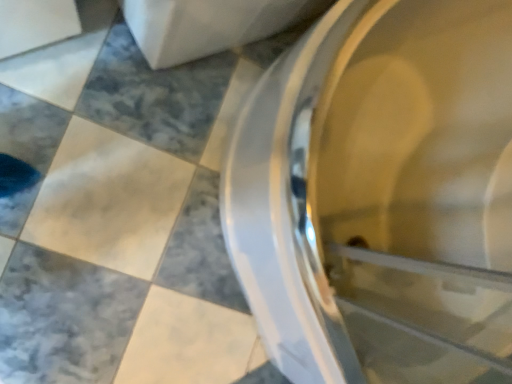
What is the approximate width of shiny metallic toilet at center?

shiny metallic toilet at center is 32.97 inches wide.

Find the location of `shiny metallic toilet at center`. shiny metallic toilet at center is located at coordinates (380, 195).

Describe the element at coordinates (380, 195) in the screenshot. This screenshot has height=384, width=512. I see `shiny metallic toilet at center` at that location.

Measure the distance between shiny metallic toilet at center and camera.

They are 16.83 inches apart.

At what (x,y) coordinates should I click in order to perform the action: click on shiny metallic toilet at center. Please return your answer as a coordinate pair (x, y). Looking at the image, I should click on (380, 195).